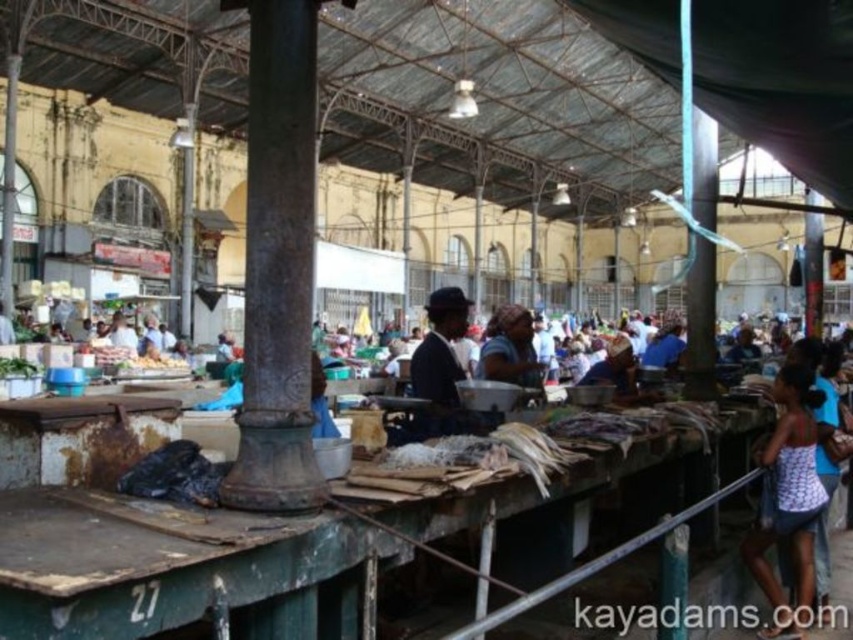
Who is more distant from viewer, (434,332) or (498,348)?

Point (498,348)

Is matte black suit at center positioned behind matte brown headscarf at center?

No, it is in front of matte brown headscarf at center.

Is point (410, 374) closer to viewer compared to point (523, 346)?

That is True.

At what (x,y) coordinates should I click in order to perform the action: click on matte black suit at center. Please return your answer as a coordinate pair (x, y). The width and height of the screenshot is (853, 640). Looking at the image, I should click on (440, 364).

Can you confirm if rusty metal pillar at center is thinner than white printed tank top at right?

In fact, rusty metal pillar at center might be wider than white printed tank top at right.

Does rusty metal pillar at center appear under white printed tank top at right?

No, rusty metal pillar at center is not below white printed tank top at right.

Is point (305, 296) positioned before point (804, 388)?

Yes, point (305, 296) is in front of point (804, 388).

Locate an element on the screen. This screenshot has width=853, height=640. rusty metal pillar at center is located at coordinates (277, 262).

Between white printed tank top at right and matte brown headscarf at center, which one is positioned lower?

white printed tank top at right

The width and height of the screenshot is (853, 640). Find the location of `white printed tank top at right`. white printed tank top at right is located at coordinates (788, 499).

Which is behind, point (811, 460) or point (520, 376)?

The point (520, 376) is behind.

Locate an element on the screen. The image size is (853, 640). white printed tank top at right is located at coordinates (788, 499).